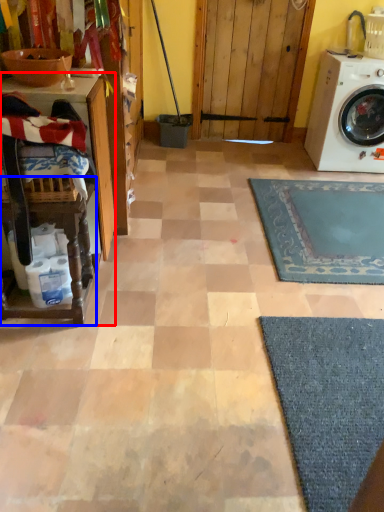
Question: Which of the following is the farthest to the observer, table (highlighted by a red box) or table (highlighted by a blue box)?

Choices:
 (A) table
 (B) table

Answer: (A)